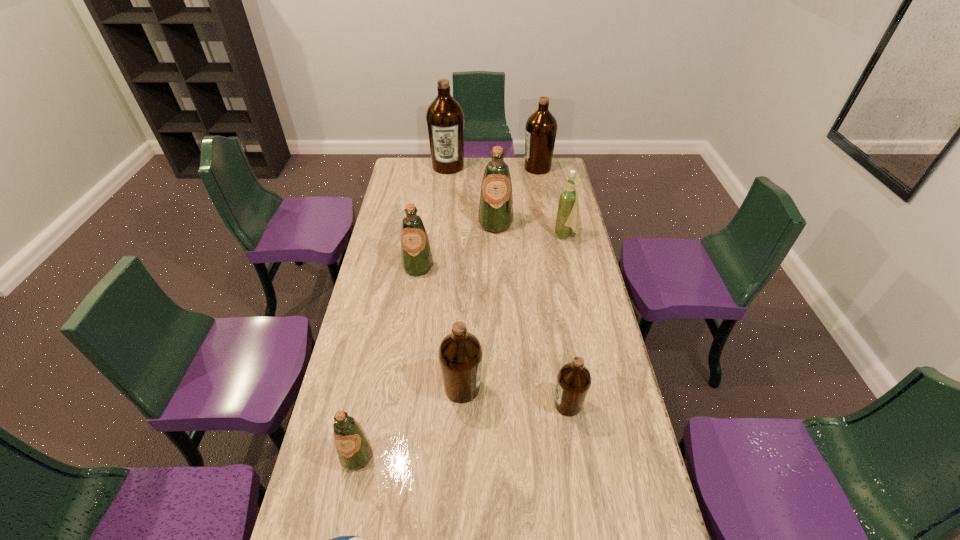
At what (x,y) coordinates should I click in order to perform the action: click on the tallest object. Please return your answer as a coordinate pair (x, y). This screenshot has width=960, height=540. Looking at the image, I should click on (445, 118).

Image resolution: width=960 pixels, height=540 pixels. I want to click on the biggest brown olive oil, so click(445, 118).

The image size is (960, 540). I want to click on the second biggest brown olive oil, so click(541, 127).

I want to click on the rightmost green olive oil, so click(x=495, y=215).

At what (x,y) coordinates should I click in order to perform the action: click on the farthest green olive oil. Please return your answer as a coordinate pair (x, y). This screenshot has height=540, width=960. Looking at the image, I should click on (495, 215).

This screenshot has height=540, width=960. I want to click on wine bottle, so click(567, 220).

Where is `the second nearest green olive oil`? The image size is (960, 540). the second nearest green olive oil is located at coordinates (417, 260).

Identify the location of the fourth nearest olive oil. (417, 260).

Locate an element on the screen. the third biggest brown olive oil is located at coordinates (460, 353).

This screenshot has width=960, height=540. Find the location of `the smallest brown olive oil`. the smallest brown olive oil is located at coordinates (574, 379).